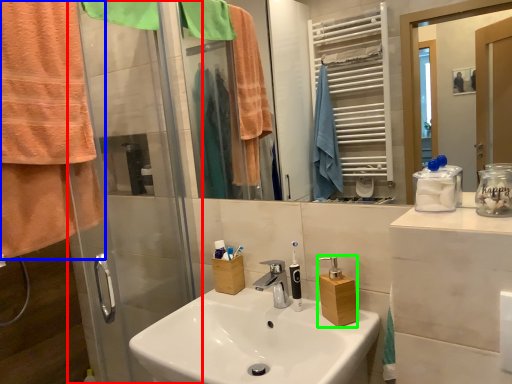
Question: Which is nearer to the shower door (highlighted by a red box)? towel/napkin (highlighted by a blue box) or bottle (highlighted by a green box).

Choices:
 (A) towel/napkin
 (B) bottle

Answer: (A)